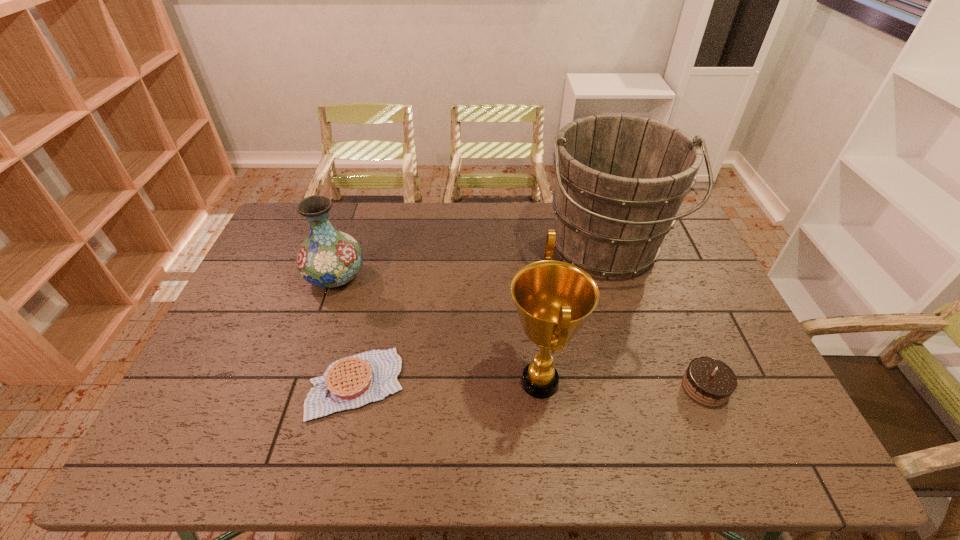
Identify the location of free space located on the left of the chocolate cake. (540, 387).

At what (x,y) coordinates should I click in order to perform the action: click on vacant space located on the right of the pie. Please return your answer as a coordinate pair (x, y). Image resolution: width=960 pixels, height=540 pixels. Looking at the image, I should click on (553, 384).

Locate an element on the screen. The height and width of the screenshot is (540, 960). object that is at the far edge is located at coordinates (620, 180).

Where is `bucket positioned at the right edge`? This screenshot has width=960, height=540. bucket positioned at the right edge is located at coordinates (620, 180).

You are a GUI agent. You are given a task and a screenshot of the screen. Output one action in this format:
    pyautogui.click(x=<x>, y=<y>)
    Task: Click on the chocolate cake situated at the right edge
    The image size is (960, 540).
    Given the screenshot: What is the action you would take?
    pyautogui.click(x=708, y=381)

Where is `object situated at the far right corner`? This screenshot has height=540, width=960. object situated at the far right corner is located at coordinates (620, 180).

The image size is (960, 540). Identify the location of free space at the far edge of the desktop. (459, 214).

Identify the location of vacant space at the near edge of the desktop. (650, 450).

Image resolution: width=960 pixels, height=540 pixels. In the image, there is a desktop. What are the coordinates of `free space at the near right corner` in the screenshot? It's located at (735, 449).

Identify the location of vacant area that lies between the third shortest object and the award. (438, 329).